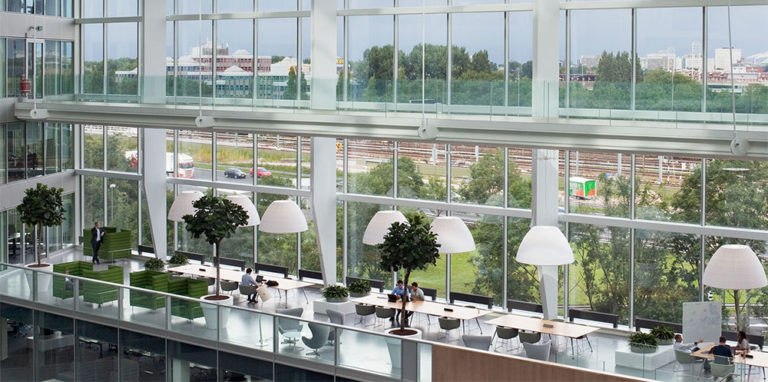
Identify the location of tables. This screenshot has height=382, width=768. (210, 272), (426, 307), (518, 323), (760, 360).